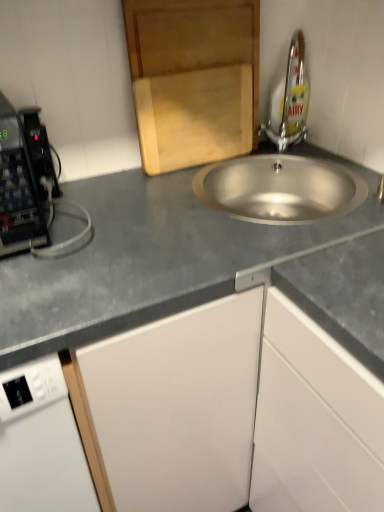
The width and height of the screenshot is (384, 512). What are the coordinates of `vacant region above gray matte countertop at center (from a real-world perspective)` in the screenshot? It's located at (239, 232).